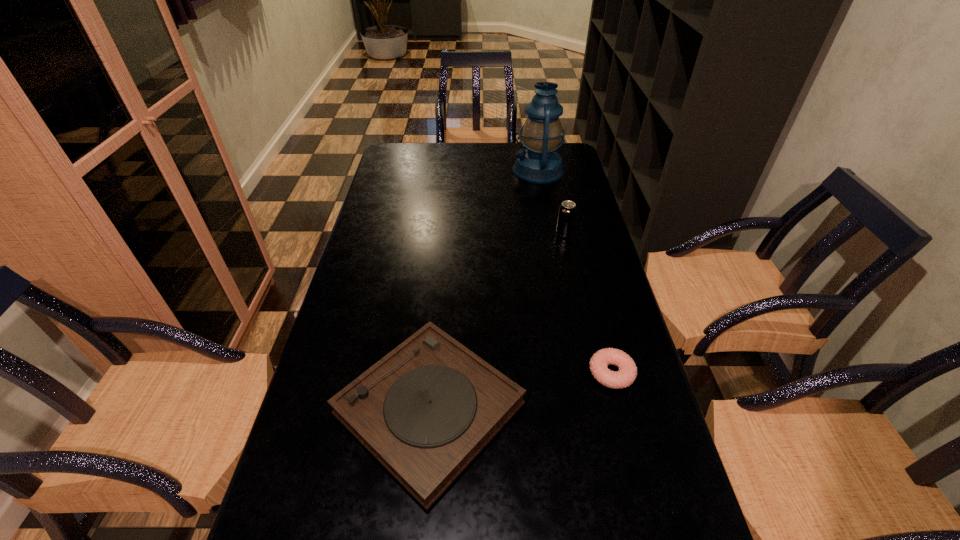
The width and height of the screenshot is (960, 540). I want to click on the farthest object, so 541,133.

This screenshot has width=960, height=540. Identify the location of lantern. (541, 133).

The height and width of the screenshot is (540, 960). In order to click on the third shortest object in this screenshot , I will do `click(567, 211)`.

Find the location of a particular element. soda can is located at coordinates (567, 211).

Where is `phonograph record`? This screenshot has width=960, height=540. phonograph record is located at coordinates (425, 410).

The height and width of the screenshot is (540, 960). Identify the location of the leftmost object. (425, 410).

Where is `doughnut`? The width and height of the screenshot is (960, 540). doughnut is located at coordinates (627, 373).

This screenshot has height=540, width=960. Identify the location of vacant region located 0.070m on the face of the tallest object. (493, 171).

At what (x,y) coordinates should I click in order to perform the action: click on free region located on the face of the tallest object. Please return your answer as a coordinate pair (x, y). This screenshot has height=540, width=960. Looking at the image, I should click on (499, 171).

Locate an element on the screen. The width and height of the screenshot is (960, 540). free point located on the face of the tallest object is located at coordinates (413, 171).